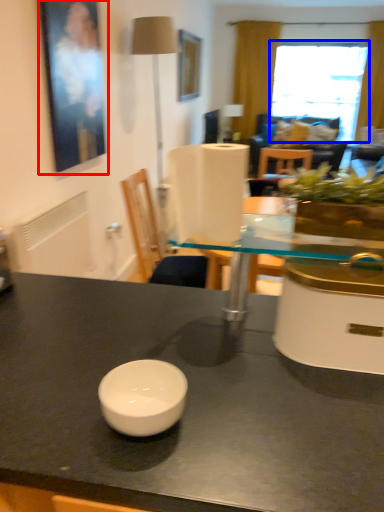
Question: Which point is closer to the camera, picture frame (highlighted by a red box) or window (highlighted by a blue box)?

Choices:
 (A) picture frame
 (B) window

Answer: (A)